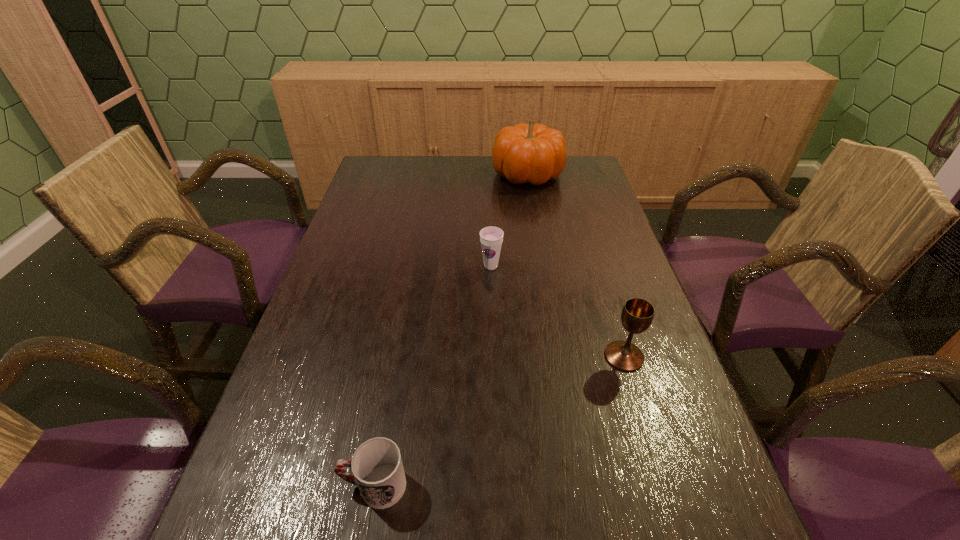
The height and width of the screenshot is (540, 960). I want to click on vacant space that is in between the farthest object and the chalice, so click(576, 265).

You are a GUI agent. You are given a task and a screenshot of the screen. Output one action in this format:
    pyautogui.click(x=<x>, y=<y>)
    Task: Click on the free area in between the second tallest object and the shortest object
    
    Given the screenshot: What is the action you would take?
    pyautogui.click(x=499, y=421)

Image resolution: width=960 pixels, height=540 pixels. I want to click on free space between the left cup and the farthest object, so click(450, 330).

Point out which object is positioned as the third nearest to the farther cup. Please provide its 2D coordinates. Your answer should be formatted as a tuple, i.e. [(x, y)], where the tuple contains the x and y coordinates of a point satisfying the conditions above.

[(377, 466)]

Where is `object that is the third closest to the second tallest object`? The height and width of the screenshot is (540, 960). object that is the third closest to the second tallest object is located at coordinates (534, 153).

Locate an element on the screen. This screenshot has width=960, height=540. vacant region that satisfies the following two spatial constraints: 1. on the front side of the tallest object; 2. on the right side of the third shortest object is located at coordinates tap(558, 356).

The image size is (960, 540). Find the location of `free location that satisfies the following two spatial constraints: 1. on the handle side of the nearest object; 2. on the back side of the pumpkin`. free location that satisfies the following two spatial constraints: 1. on the handle side of the nearest object; 2. on the back side of the pumpkin is located at coordinates (430, 174).

Image resolution: width=960 pixels, height=540 pixels. Identify the location of vacant space that satisfies the following two spatial constraints: 1. on the handle side of the pumpkin; 2. on the left side of the shorter cup. (430, 174).

You are a GUI agent. You are given a task and a screenshot of the screen. Output one action in this format:
    pyautogui.click(x=<x>, y=<y>)
    Task: Click on the free point that satisfies the following two spatial constraints: 1. on the handle side of the third farthest object; 2. on the right side of the leftmost object
    Image resolution: width=960 pixels, height=540 pixels.
    Given the screenshot: What is the action you would take?
    pyautogui.click(x=397, y=356)